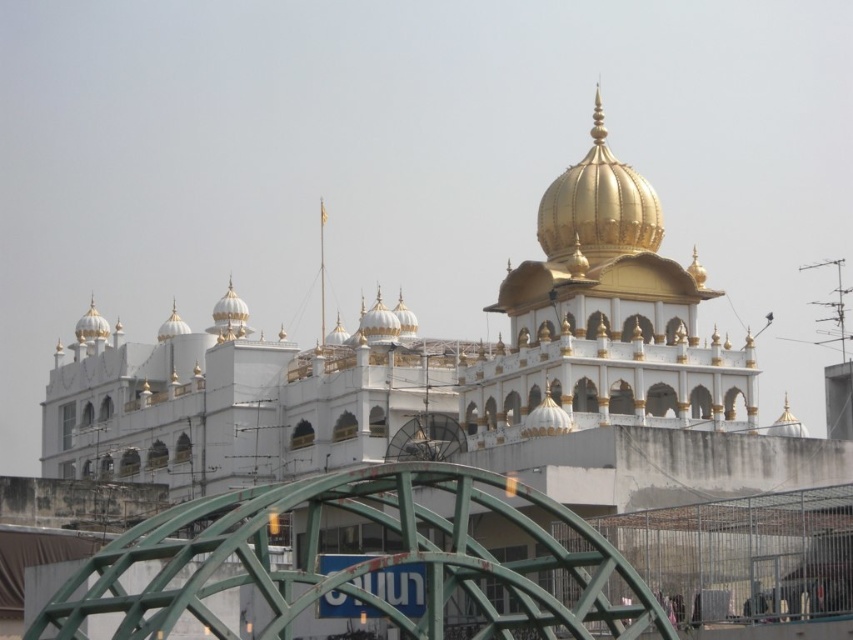
You are standing on the green metallic bridge at lower center and want to take a photo of the gold polished dome at center. Is the dome visible from your current position?

The green metallic bridge at lower center is below the gold polished dome at center, so the dome is visible from the bridge as it is positioned above.

You are a photographer standing at the camera position. You want to capture a clear photo of the Sikh temple with its golden dome without the green metallic bridge at lower center blocking the view. What is the minimum distance you need to move backward to ensure the bridge is no longer in the frame?

The green metallic bridge at lower center is currently 53.33 meters away from the camera. To ensure it is no longer in the frame, you would need to move backward until the bridge is out of the camera lens view. However, without knowing the camera lens specifications, it is impossible to determine the exact distance required. Alternatively, adjusting the camera angle or using a different lens might help eliminate the bridge from the shot.

You are a photographer planning to capture the gold polished dome at center from the green metallic bridge at lower center. Considering the bridge might be wider than the dome, would you need to adjust your position to ensure the dome is fully visible in the frame?

The green metallic bridge at lower center might be wider than the gold polished dome at center, so you might need to adjust your position to ensure the dome is fully visible in the frame.